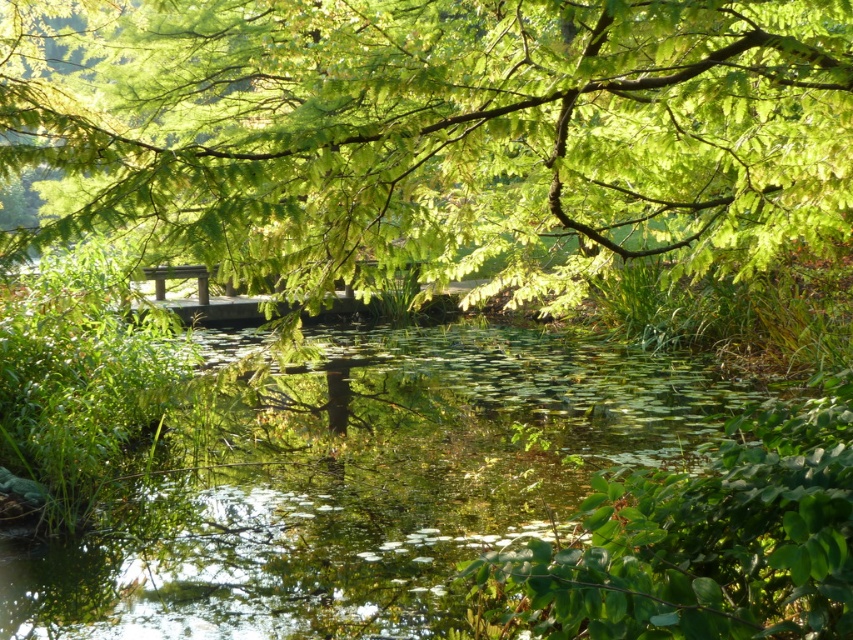
Question: Is green leafy tree at upper center bigger than green leafy water at center?

Choices:
 (A) no
 (B) yes

Answer: (B)

Question: From the image, what is the correct spatial relationship of green leafy tree at upper center in relation to green leafy water at center?

Choices:
 (A) below
 (B) above

Answer: (B)

Question: Which point is closer to the camera?

Choices:
 (A) green leafy tree at upper center
 (B) green leafy water at center

Answer: (A)

Question: Which object is farther from the camera taking this photo?

Choices:
 (A) green leafy water at center
 (B) green leafy tree at upper center

Answer: (A)

Question: Which of the following is the farthest from the observer?

Choices:
 (A) (393, 333)
 (B) (718, 198)

Answer: (A)

Question: Is green leafy tree at upper center to the right of green leafy water at center from the viewer's perspective?

Choices:
 (A) no
 (B) yes

Answer: (A)